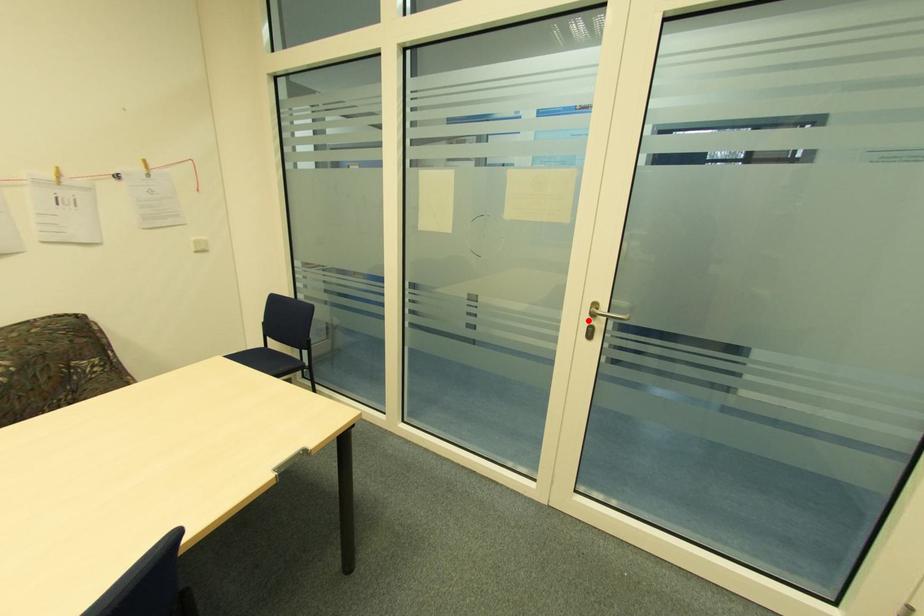
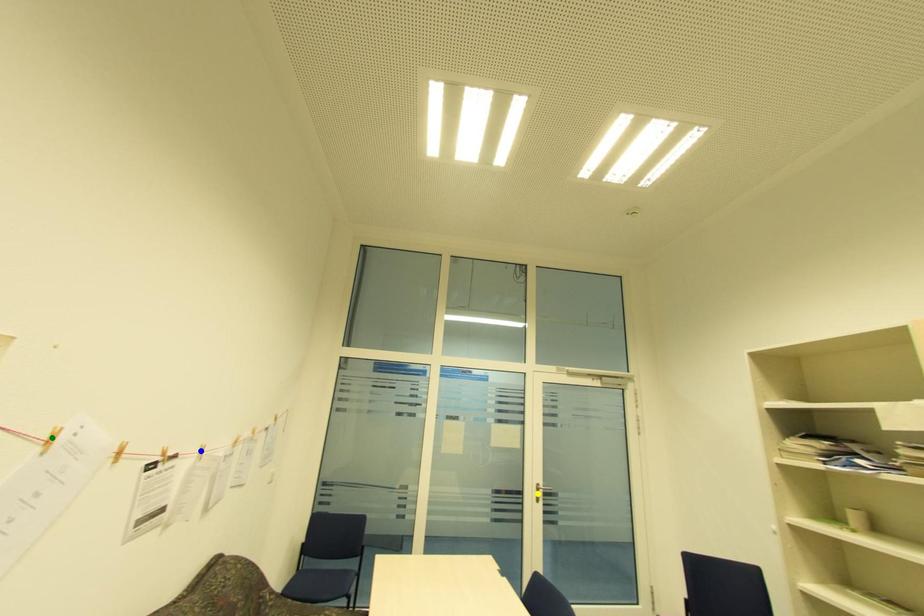
Question: I am providing you with two images of the same scene from different viewpoints. A red point is marked on the first image. You are given multiple points on the second image. In image 2, which mark is for the same physical point as the one in image 1?

Choices:
 (A) blue point
 (B) green point
 (C) yellow point

Answer: (C)